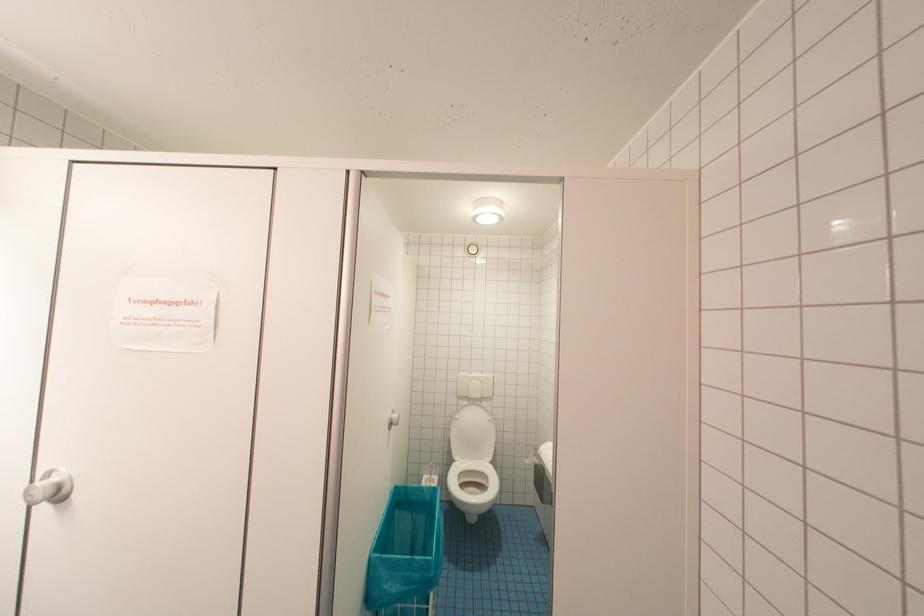
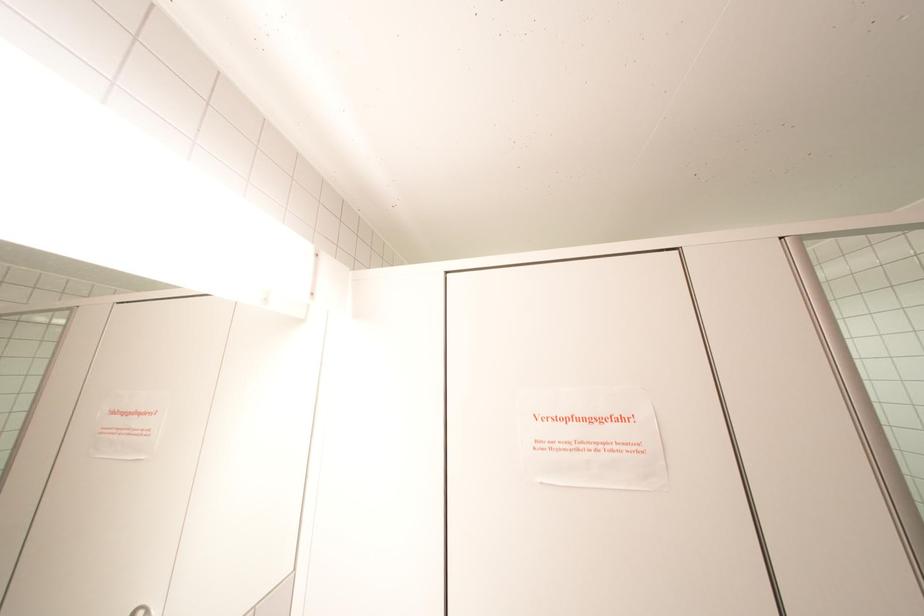
Question: The images are taken continuously from a first-person perspective. In which direction are you moving?

Choices:
 (A) Left
 (B) Right
 (C) Forward
 (D) Backward

Answer: (A)